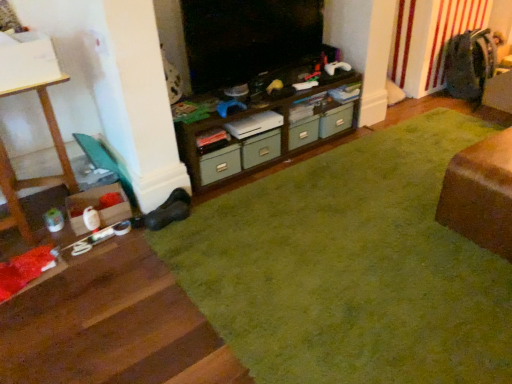
Question: Is there a large distance between green matte drawer at center, placed as the 1th drawer when sorted from right to left, and green carpet at center?

Choices:
 (A) no
 (B) yes

Answer: (A)

Question: From a real-world perspective, is green matte drawer at center, the first drawer viewed from the back, beneath green carpet at center?

Choices:
 (A) no
 (B) yes

Answer: (A)

Question: Considering the relative sizes of green matte drawer at center, the second drawer positioned from the left, and green carpet at center in the image provided, is green matte drawer at center, the second drawer positioned from the left, thinner than green carpet at center?

Choices:
 (A) no
 (B) yes

Answer: (B)

Question: Can you confirm if green matte drawer at center, which is the 2th drawer in front-to-back order, is smaller than green carpet at center?

Choices:
 (A) no
 (B) yes

Answer: (B)

Question: Considering the relative sizes of green matte drawer at center, the second drawer positioned from the left, and green carpet at center in the image provided, is green matte drawer at center, the second drawer positioned from the left, taller than green carpet at center?

Choices:
 (A) no
 (B) yes

Answer: (B)

Question: From the image's perspective, is green fabric drawer at center, the first drawer positioned from the front, above or below brown wood table at lower right?

Choices:
 (A) below
 (B) above

Answer: (B)

Question: In terms of height, does green fabric drawer at center, placed as the 1th drawer when sorted from left to right, look taller or shorter compared to brown wood table at lower right?

Choices:
 (A) short
 (B) tall

Answer: (A)

Question: In terms of width, does green fabric drawer at center, placed as the 1th drawer when sorted from left to right, look wider or thinner when compared to brown wood table at lower right?

Choices:
 (A) thin
 (B) wide

Answer: (A)

Question: Is point (251, 140) positioned closer to the camera than point (478, 190)?

Choices:
 (A) closer
 (B) farther

Answer: (B)

Question: Is green matte drawer at center, the first drawer viewed from the back, taller or shorter than wooden table at left?

Choices:
 (A) tall
 (B) short

Answer: (B)

Question: Would you say green matte drawer at center, placed as the 1th drawer when sorted from right to left, is inside or outside wooden table at left?

Choices:
 (A) inside
 (B) outside

Answer: (B)

Question: Is point (304, 119) positioned closer to the camera than point (9, 178)?

Choices:
 (A) closer
 (B) farther

Answer: (B)

Question: From a real-world perspective, is green matte drawer at center, which is the 2th drawer in front-to-back order, physically located above or below wooden table at left?

Choices:
 (A) below
 (B) above

Answer: (A)

Question: Is point (313, 124) closer or farther from the camera than point (353, 127)?

Choices:
 (A) farther
 (B) closer

Answer: (B)

Question: Considering the positions of green matte drawer at center, placed as the 1th drawer when sorted from right to left, and brown wood cabinet at center in the image, is green matte drawer at center, placed as the 1th drawer when sorted from right to left, taller or shorter than brown wood cabinet at center?

Choices:
 (A) tall
 (B) short

Answer: (B)